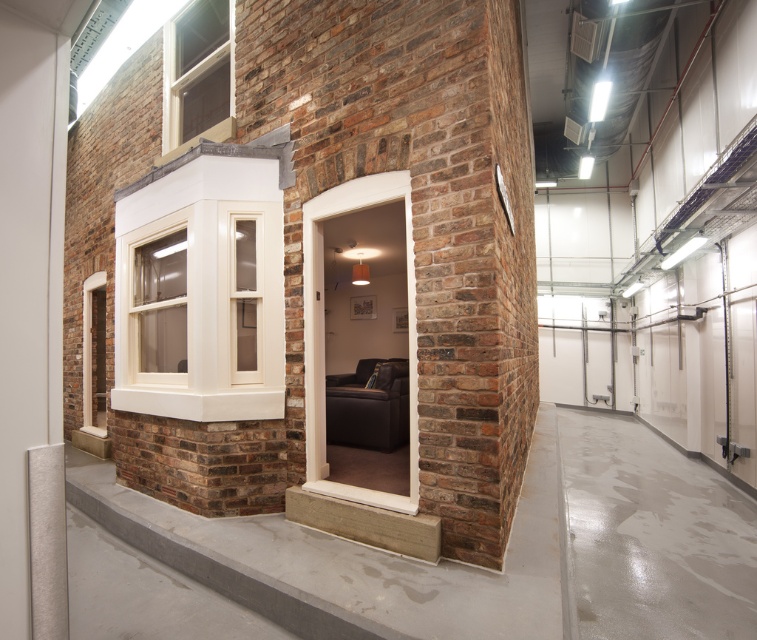
Question: Which object appears closest to the camera in this image?

Choices:
 (A) white wood window at upper left
 (B) brown brick at center
 (C) matte white window at upper left

Answer: (B)

Question: In this image, where is brown brick at center located relative to white wood window at upper left?

Choices:
 (A) below
 (B) above

Answer: (A)

Question: Which object is positioned farthest from the brown brick at center?

Choices:
 (A) matte white window at upper left
 (B) white glossy window at upper left

Answer: (A)

Question: Does brown brick at center have a smaller size compared to matte white window at upper left?

Choices:
 (A) yes
 (B) no

Answer: (A)

Question: Is brown brick at center above matte white window at upper left?

Choices:
 (A) yes
 (B) no

Answer: (B)

Question: Considering the real-world distances, which object is closest to the brown brick at center?

Choices:
 (A) white glossy window at upper left
 (B) white wood window at upper left
 (C) matte white window at upper left

Answer: (A)